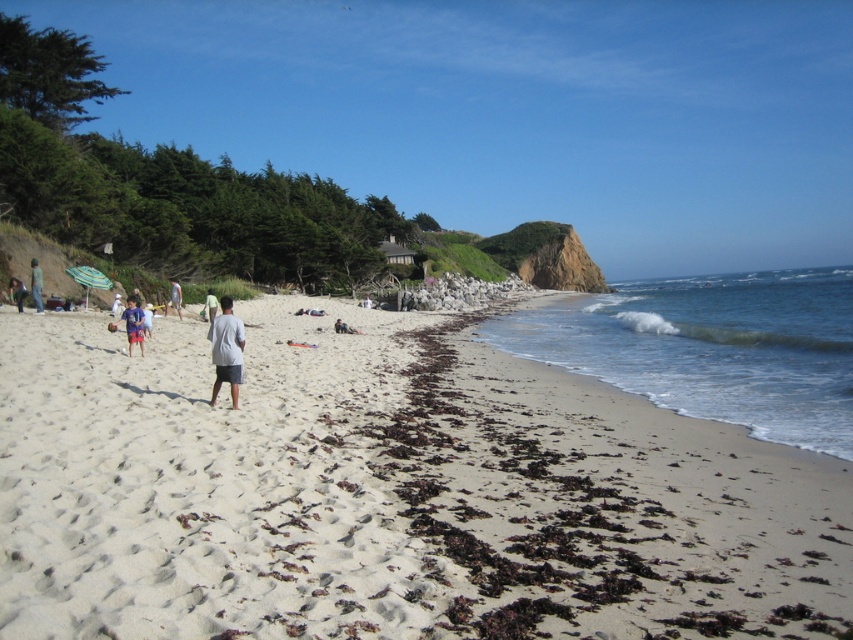
Can you confirm if white sandy beach at center is thinner than matte gray shorts at center?

No, white sandy beach at center is not thinner than matte gray shorts at center.

Who is shorter, white sandy beach at center or matte gray shorts at center?

With less height is matte gray shorts at center.

Where is `white sandy beach at center`? The height and width of the screenshot is (640, 853). white sandy beach at center is located at coordinates [x=389, y=493].

Between point (224, 312) and point (141, 342), which one is positioned behind?

Point (141, 342)

Who is more distant from viewer, (x=241, y=371) or (x=136, y=314)?

The point (x=136, y=314) is behind.

Find the location of a particular element. gray cotton shirt at center is located at coordinates (225, 349).

Does white sandy beach at center appear under blue cotton shorts at lower left?

Yes.

Can you confirm if white sandy beach at center is shorter than blue cotton shorts at lower left?

No, white sandy beach at center is not shorter than blue cotton shorts at lower left.

The height and width of the screenshot is (640, 853). Find the location of `white sandy beach at center`. white sandy beach at center is located at coordinates (389, 493).

At what (x,y) coordinates should I click in order to perform the action: click on white sandy beach at center. Please return your answer as a coordinate pair (x, y). The image size is (853, 640). Looking at the image, I should click on (389, 493).